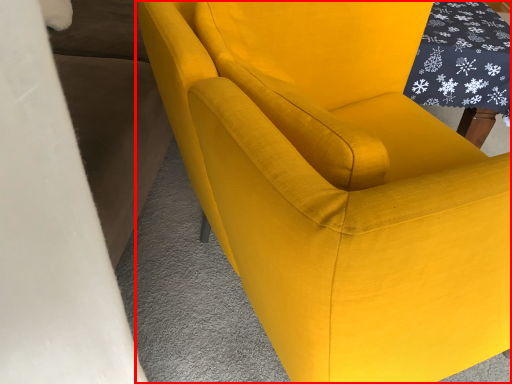
Question: From the image's perspective, what is the correct spatial positioning of chair (annotated by the red box) in reference to table?

Choices:
 (A) above
 (B) below

Answer: (B)